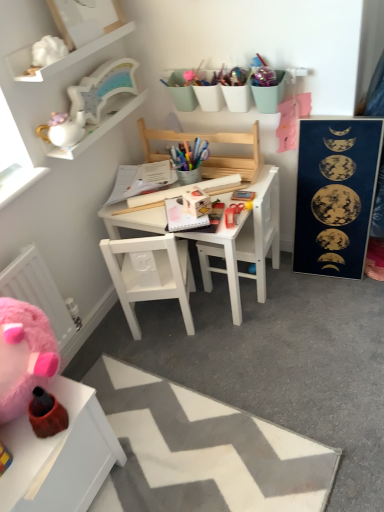
Locate an element on the screen. The width and height of the screenshot is (384, 512). empty space that is ontop of white wooden changing table at center (from a real-world perspective) is located at coordinates (223, 177).